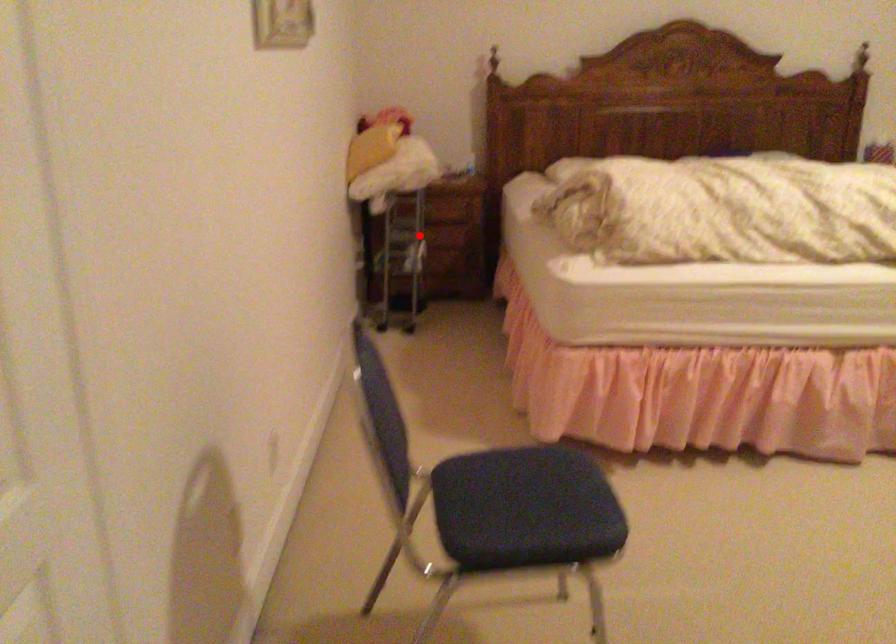
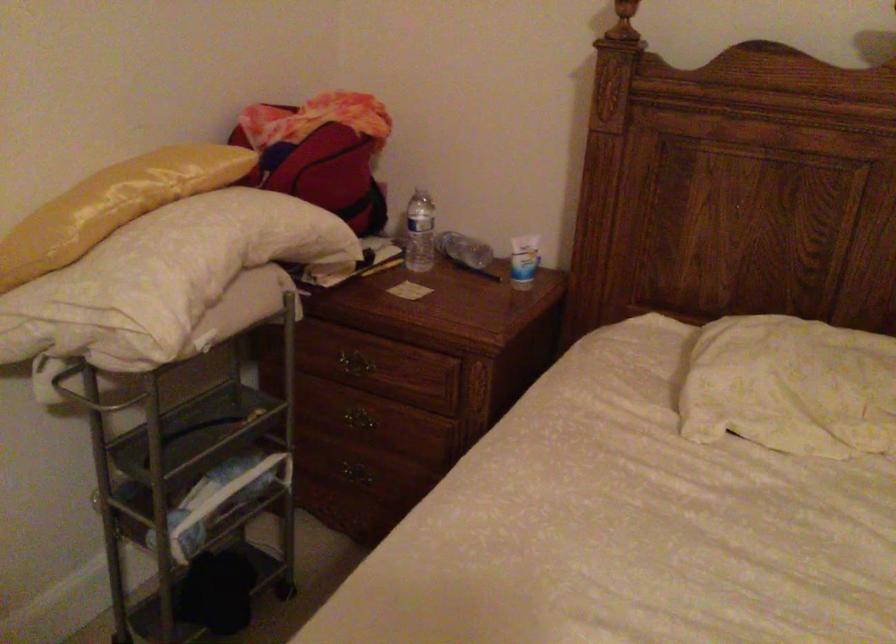
The point at the highlighted location is marked in the first image. Where is the corresponding point in the second image?

(357, 426)